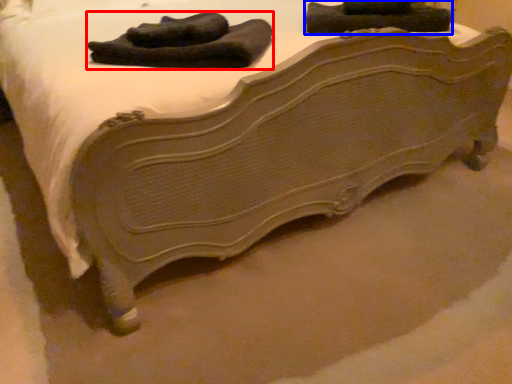
Question: Which of the following is the closest to the observer, laundry (highlighted by a red box) or clothing (highlighted by a blue box)?

Choices:
 (A) laundry
 (B) clothing

Answer: (A)